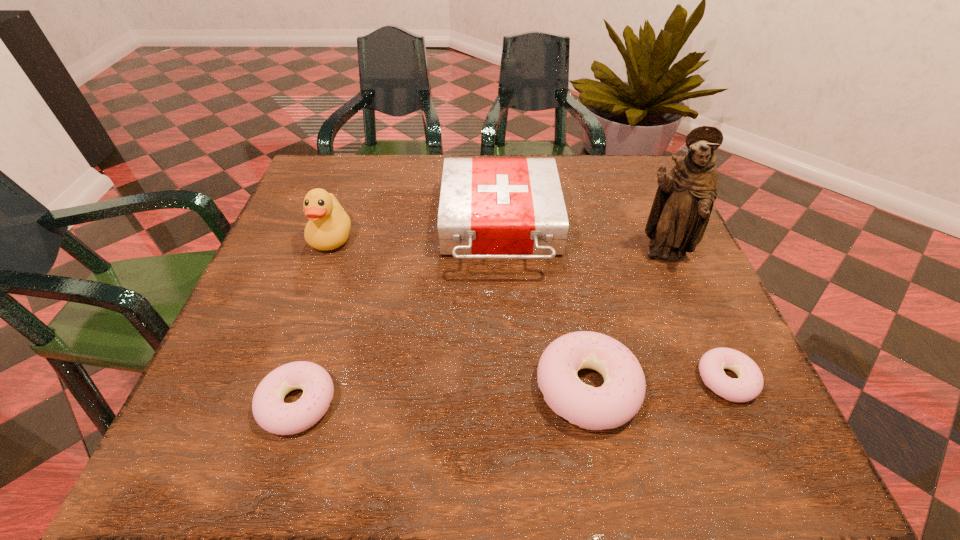
Image resolution: width=960 pixels, height=540 pixels. In order to click on object that is at the near left corner in this screenshot , I will do `click(269, 410)`.

I want to click on object that is at the near right corner, so click(748, 386).

The width and height of the screenshot is (960, 540). In order to click on free space at the far edge in this screenshot , I will do `click(439, 206)`.

This screenshot has width=960, height=540. In the image, there is a desktop. Find the location of `blank space at the near edge`. blank space at the near edge is located at coordinates (532, 381).

The image size is (960, 540). In the image, there is a desktop. What are the coordinates of `vacant space at the left edge` in the screenshot? It's located at click(x=284, y=236).

This screenshot has width=960, height=540. I want to click on free space at the right edge, so click(x=697, y=326).

This screenshot has height=540, width=960. I want to click on unoccupied area between the shortest doughnut and the fifth tallest object, so click(x=512, y=391).

This screenshot has height=540, width=960. I want to click on empty location between the leftmost doughnut and the figurine, so click(x=480, y=329).

Locate an element on the screen. Image resolution: width=960 pixels, height=540 pixels. blank region between the third shortest object and the leftmost doughnut is located at coordinates (443, 395).

At what (x,y) coordinates should I click in order to perform the action: click on free space between the duck and the second shortest doughnut. Please return your answer as a coordinate pair (x, y). Looking at the image, I should click on (315, 320).